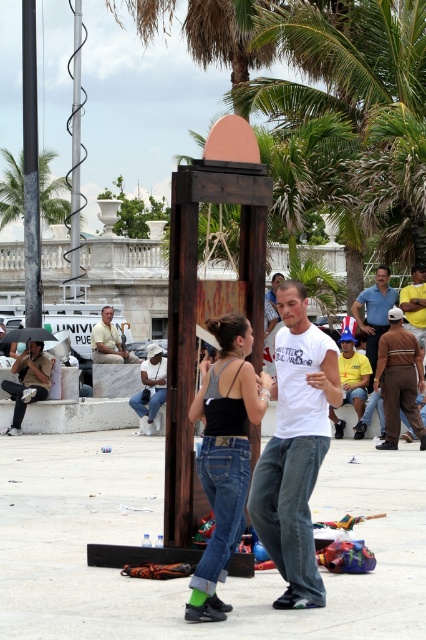
Question: Is smooth black pole at left closer to the viewer compared to green leafy palm tree at upper left?

Choices:
 (A) no
 (B) yes

Answer: (B)

Question: Can you confirm if blue denim jeans at center is wider than matte brown wooden chair at center?

Choices:
 (A) no
 (B) yes

Answer: (A)

Question: Which object is closer to the camera taking this photo?

Choices:
 (A) brown leather jacket at lower right
 (B) dark blue jeans at lower left
 (C) green leafy palm tree at upper left

Answer: (A)

Question: Which point is farther to the camera?

Choices:
 (A) yellow fabric shirt at lower right
 (B) brown leather jacket at lower right
 (C) dark blue jeans at lower left
 (D) green leafy palm tree at upper left

Answer: (D)

Question: Estimate the real-world distances between objects in this image. Which object is closer to the denim jeans at center?

Choices:
 (A) blue denim jeans at center
 (B) dark blue jeans at lower left
 (C) smooth black pole at left

Answer: (A)

Question: Is smooth black pole at left positioned in front of matte brown wooden chair at center?

Choices:
 (A) no
 (B) yes

Answer: (B)